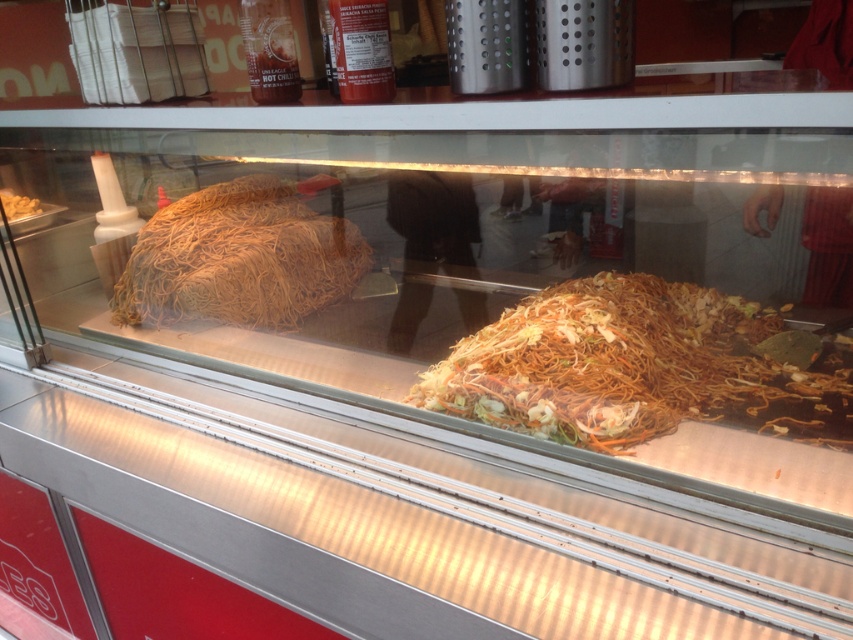
You are a customer at the food stall and want to know which item is wider between the shiny brown noodles at center and the white matte bread at upper left. Can you tell me?

The shiny brown noodles at center are wider than the white matte bread at upper left according to the description.

Consider the image. You are a customer at the food stall and want to order the shiny brown noodles at center. The vendor asks you to point to the exact location of the noodles using coordinates. What coordinates should you provide?

The shiny brown noodles at center are located at point (631, 368), so you should tell the vendor the coordinates (631, 368).